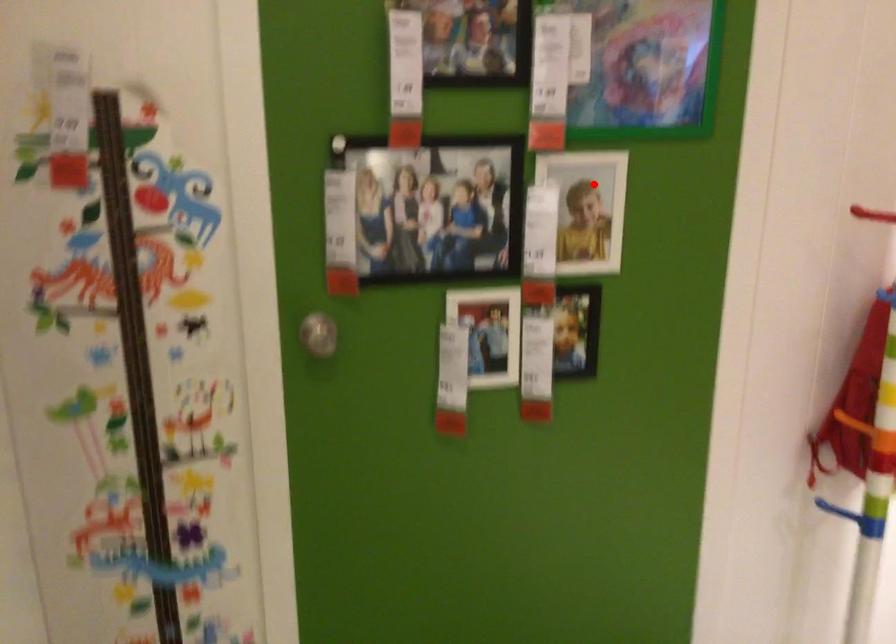
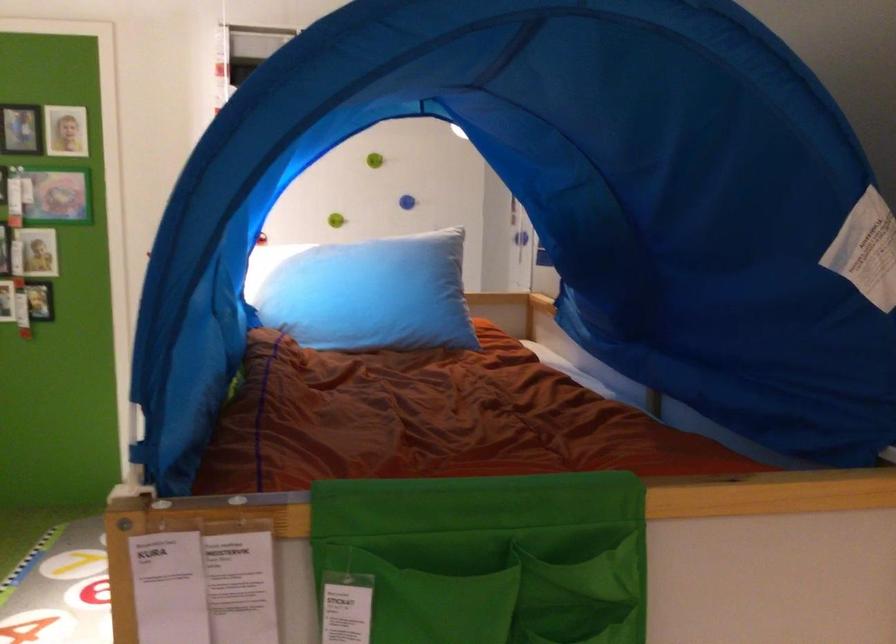
Where in the second image is the point corresponding to the highlighted location from the first image?

(39, 251)